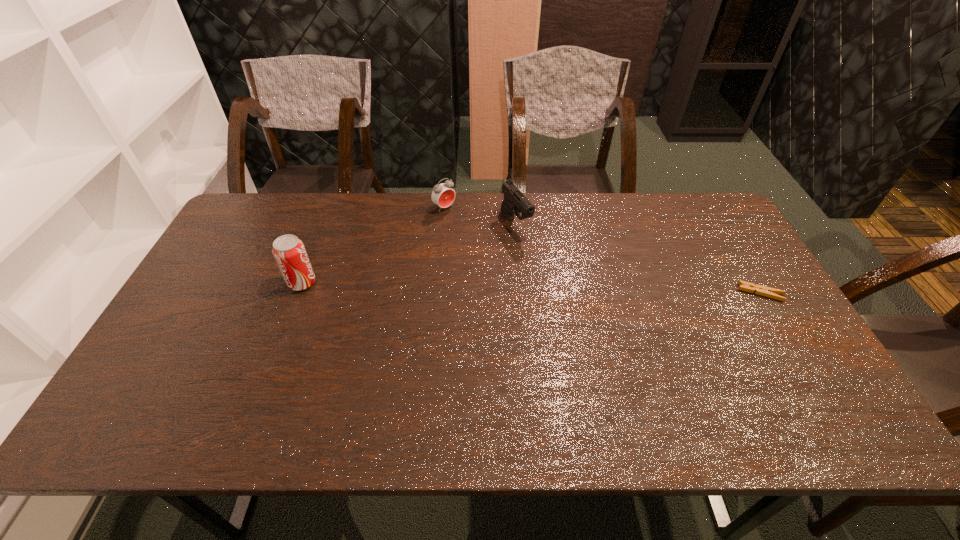
Locate an element on the screen. This screenshot has width=960, height=540. vacant space in between the third object from left to right and the soda can is located at coordinates (409, 253).

Identify the location of free spot between the shortest object and the third object from left to right. The height and width of the screenshot is (540, 960). (638, 258).

This screenshot has height=540, width=960. In order to click on empty location between the third object from right to left and the leftmost object in this screenshot , I will do `click(373, 245)`.

Point out which object is positioned as the third nearest to the second object from right to left. Please provide its 2D coordinates. Your answer should be formatted as a tuple, i.e. [(x, y)], where the tuple contains the x and y coordinates of a point satisfying the conditions above.

[(761, 290)]

Identify which object is the third nearest to the third object from left to right. Please provide its 2D coordinates. Your answer should be formatted as a tuple, i.e. [(x, y)], where the tuple contains the x and y coordinates of a point satisfying the conditions above.

[(761, 290)]